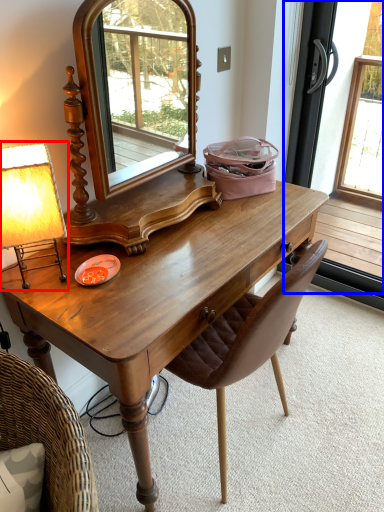
Question: Which object is further to the camera taking this photo, table lamp (highlighted by a red box) or screen door (highlighted by a blue box)?

Choices:
 (A) table lamp
 (B) screen door

Answer: (B)